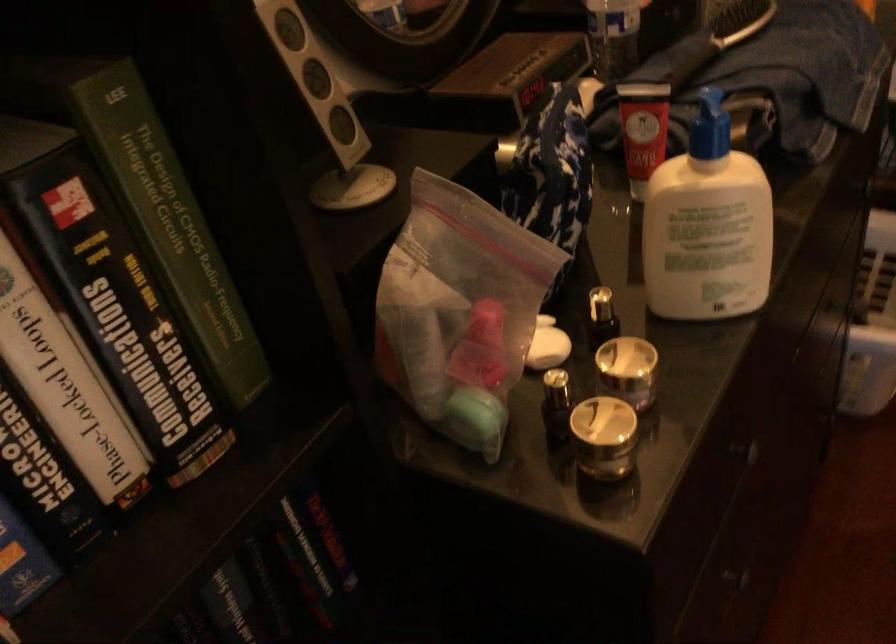
Locate an element on the screen. The height and width of the screenshot is (644, 896). white lotion bottle is located at coordinates (707, 225).